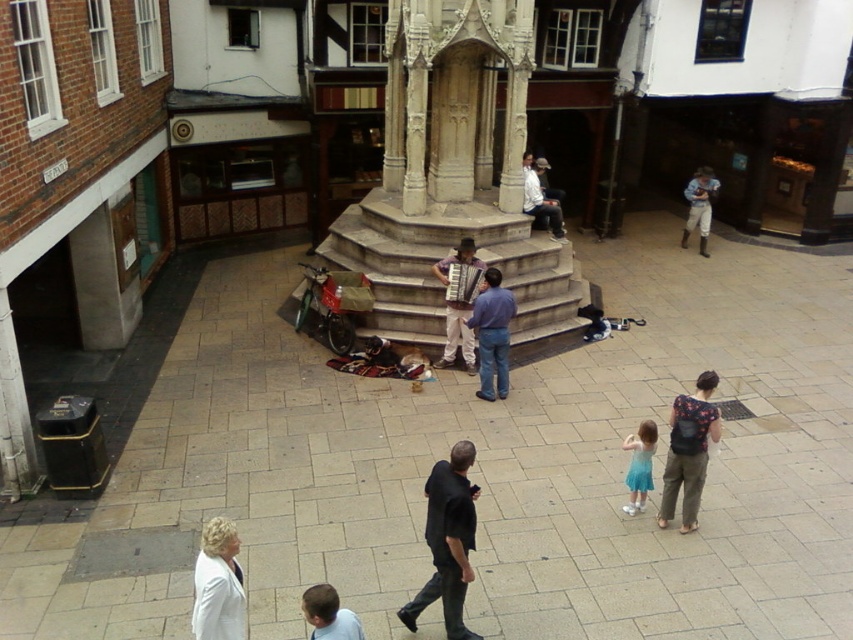
You are a fashion blogger visiting the courtyard and notice the blue denim jeans at right and the light brown leather jacket at center. Which item is placed higher in the scene?

The blue denim jeans at right is positioned over light brown leather jacket at center, so it is placed higher.

You are a photographer setting up a tripod in the courtyard. You need to position it so that both the blue denim jeans at right and the light brown leather jacket at center are visible in the frame. Considering their heights, which object should be placed closer to the front of the frame to ensure both are fully visible?

The light brown leather jacket at center is shorter than the blue denim jeans at right. To ensure both are fully visible, place the light brown leather jacket at center closer to the front of the frame so it doesn